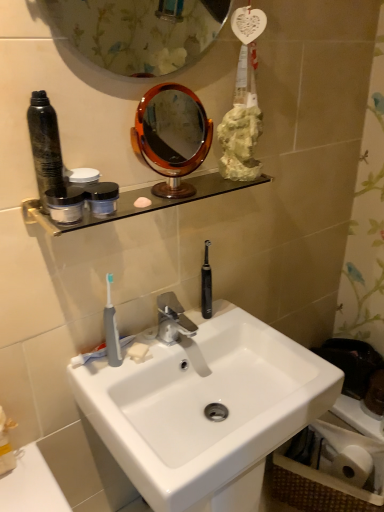
Question: Can you confirm if black rubber toothbrush at center, the 2th toothbrush when ordered from front to back, is shorter than white matte soap at sink?

Choices:
 (A) yes
 (B) no

Answer: (B)

Question: Is black rubber toothbrush at center, acting as the first toothbrush starting from the back, positioned beyond the bounds of white matte soap at sink?

Choices:
 (A) yes
 (B) no

Answer: (A)

Question: Is black rubber toothbrush at center, acting as the first toothbrush starting from the back, beside white matte soap at sink?

Choices:
 (A) yes
 (B) no

Answer: (B)

Question: Does black rubber toothbrush at center, acting as the first toothbrush starting from the back, appear on the right side of white matte soap at sink?

Choices:
 (A) yes
 (B) no

Answer: (A)

Question: Would you say white matte soap at sink is part of black rubber toothbrush at center, the 2th toothbrush from the left,'s contents?

Choices:
 (A) no
 (B) yes

Answer: (A)

Question: In terms of size, does amber glass mirror at upper center appear bigger or smaller than silver metallic faucet at center?

Choices:
 (A) small
 (B) big

Answer: (B)

Question: Considering the positions of amber glass mirror at upper center and silver metallic faucet at center in the image, is amber glass mirror at upper center wider or thinner than silver metallic faucet at center?

Choices:
 (A) wide
 (B) thin

Answer: (B)

Question: From the image's perspective, relative to silver metallic faucet at center, is amber glass mirror at upper center above or below?

Choices:
 (A) above
 (B) below

Answer: (A)

Question: Would you say amber glass mirror at upper center is to the left or to the right of silver metallic faucet at center in the picture?

Choices:
 (A) right
 (B) left

Answer: (B)

Question: Is point (104, 333) positioned closer to the camera than point (135, 351)?

Choices:
 (A) closer
 (B) farther

Answer: (A)

Question: From the image's perspective, is gray rubber toothbrush at sink, arranged as the 2th toothbrush when viewed from the right, located above or below white matte soap at sink?

Choices:
 (A) below
 (B) above

Answer: (B)

Question: Considering their positions, is gray rubber toothbrush at sink, which appears as the first toothbrush when viewed from the left, located in front of or behind white matte soap at sink?

Choices:
 (A) front
 (B) behind

Answer: (A)

Question: Do you think gray rubber toothbrush at sink, arranged as the 2th toothbrush when viewed from the right, is within white matte soap at sink, or outside of it?

Choices:
 (A) inside
 (B) outside

Answer: (B)

Question: From a real-world perspective, is clear glass shelf at upper center above or below white matte soap at sink?

Choices:
 (A) below
 (B) above

Answer: (B)

Question: Which is correct: clear glass shelf at upper center is inside white matte soap at sink, or outside of it?

Choices:
 (A) outside
 (B) inside

Answer: (A)